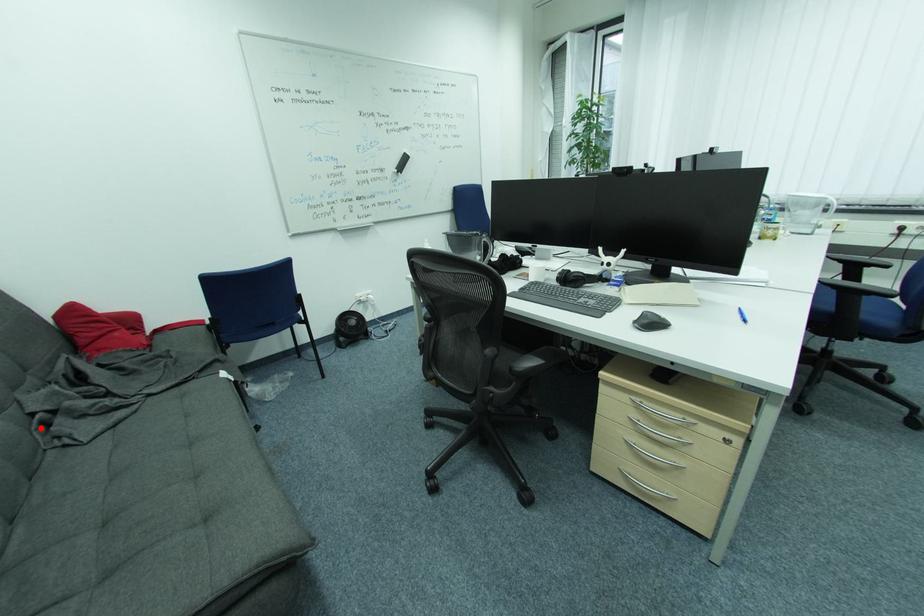
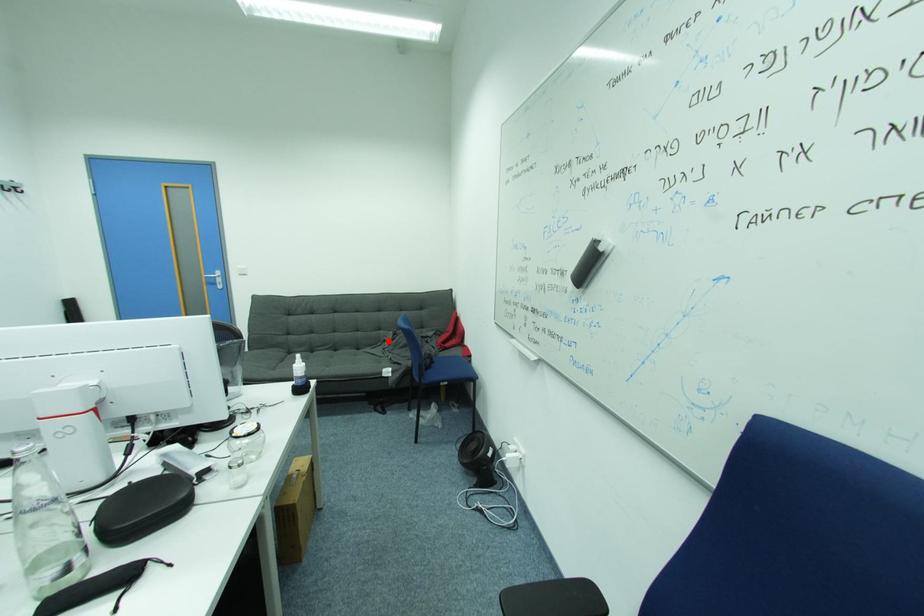
I am providing you with two images of the same scene from different viewpoints. A red point is marked on the first image and another point is marked on the second image. Do the highlighted points in image1 and image2 indicate the same real-world spot?

Yes